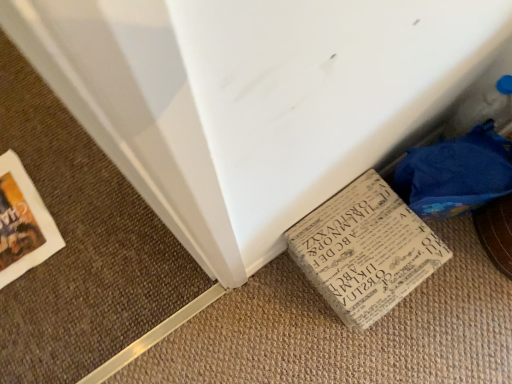
Find the location of a particular element. Image resolution: width=512 pixels, height=384 pixels. empty space that is ontop of printed paper book at lower right (from a real-world perspective) is located at coordinates (384, 271).